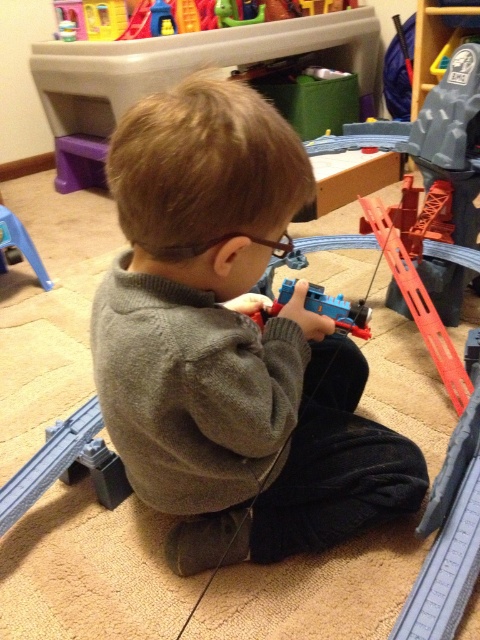
Question: Which object is closer to the camera taking this photo?

Choices:
 (A) blue plastic toy train at center
 (B) blue plastic toy at left
 (C) plastic toy train at upper center
 (D) gray wool sweater at center

Answer: (D)

Question: Is plastic toy train at upper center closer to the viewer compared to blue plastic toy train at center?

Choices:
 (A) yes
 (B) no

Answer: (B)

Question: Which object appears closest to the camera in this image?

Choices:
 (A) plastic toy train at upper center
 (B) blue plastic toy train at center
 (C) gray wool sweater at center
 (D) blue plastic toy at left

Answer: (C)

Question: Is gray wool sweater at center positioned at the back of plastic toy train at upper center?

Choices:
 (A) yes
 (B) no

Answer: (B)

Question: Can you confirm if gray wool sweater at center is positioned to the left of blue plastic toy at left?

Choices:
 (A) yes
 (B) no

Answer: (B)

Question: Which point is closer to the camera?

Choices:
 (A) (35, 253)
 (B) (214, 19)
 (C) (324, 300)
 (D) (122, 394)

Answer: (D)